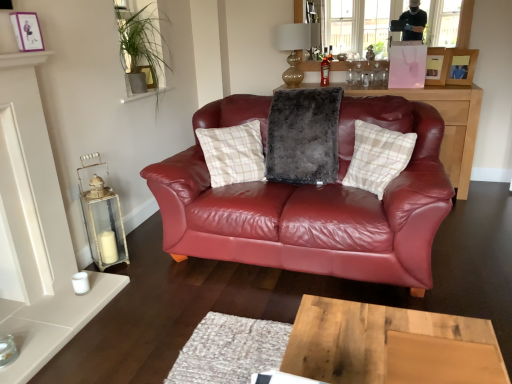
Question: Is translucent glass bottle at center thinner than fuzzy gray pillow at center, arranged as the second pillow when viewed from the right?

Choices:
 (A) yes
 (B) no

Answer: (A)

Question: Considering the relative sizes of translucent glass bottle at center and fuzzy gray pillow at center, which appears as the 1th pillow when viewed from the left, in the image provided, is translucent glass bottle at center shorter than fuzzy gray pillow at center, which appears as the 1th pillow when viewed from the left,?

Choices:
 (A) no
 (B) yes

Answer: (B)

Question: From the image's perspective, is translucent glass bottle at center on fuzzy gray pillow at center, which appears as the 1th pillow when viewed from the left?

Choices:
 (A) no
 (B) yes

Answer: (B)

Question: Is translucent glass bottle at center next to fuzzy gray pillow at center, arranged as the second pillow when viewed from the right?

Choices:
 (A) yes
 (B) no

Answer: (B)

Question: From the image's perspective, is translucent glass bottle at center below fuzzy gray pillow at center, which appears as the 1th pillow when viewed from the left?

Choices:
 (A) yes
 (B) no

Answer: (B)

Question: From the image's perspective, is white distressed wood lantern at left above or below plaid fabric pillow at center, which ranks as the 1th pillow in right-to-left order?

Choices:
 (A) below
 (B) above

Answer: (A)

Question: Is white distressed wood lantern at left situated inside plaid fabric pillow at center, which ranks as the 1th pillow in right-to-left order, or outside?

Choices:
 (A) outside
 (B) inside

Answer: (A)

Question: From a real-world perspective, is white distressed wood lantern at left physically located above or below plaid fabric pillow at center, which ranks as the 1th pillow in right-to-left order?

Choices:
 (A) above
 (B) below

Answer: (B)

Question: In terms of size, does white distressed wood lantern at left appear bigger or smaller than plaid fabric pillow at center, which ranks as the 1th pillow in right-to-left order?

Choices:
 (A) big
 (B) small

Answer: (B)

Question: In terms of size, does plaid fabric pillow at center, which ranks as the 1th pillow in right-to-left order, appear bigger or smaller than white distressed wood lantern at left?

Choices:
 (A) small
 (B) big

Answer: (B)

Question: Is plaid fabric pillow at center, the 2th pillow in the left-to-right sequence, to the left or to the right of white distressed wood lantern at left in the image?

Choices:
 (A) left
 (B) right

Answer: (B)

Question: Is plaid fabric pillow at center, which ranks as the 1th pillow in right-to-left order, wider or thinner than white distressed wood lantern at left?

Choices:
 (A) thin
 (B) wide

Answer: (B)

Question: Is point (402, 140) closer or farther from the camera than point (109, 193)?

Choices:
 (A) farther
 (B) closer

Answer: (B)

Question: Is gold glass lampshade at upper center bigger or smaller than white distressed wood lantern at left?

Choices:
 (A) small
 (B) big

Answer: (B)

Question: From a real-world perspective, is gold glass lampshade at upper center positioned above or below white distressed wood lantern at left?

Choices:
 (A) below
 (B) above

Answer: (B)